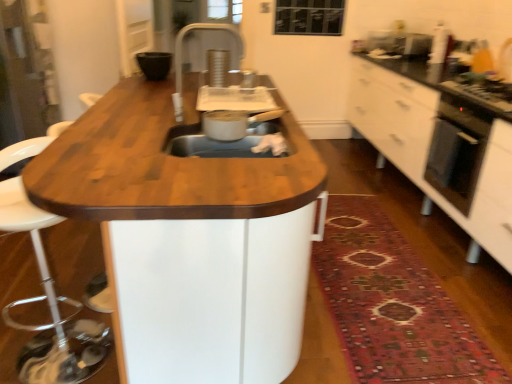
Question: From the image's perspective, is wooden table at center below white glossy cabinet at right?

Choices:
 (A) no
 (B) yes

Answer: (B)

Question: Does wooden table at center have a greater height compared to white glossy cabinet at right?

Choices:
 (A) yes
 (B) no

Answer: (A)

Question: Is wooden table at center positioned behind white glossy cabinet at right?

Choices:
 (A) yes
 (B) no

Answer: (B)

Question: Is there a large distance between wooden table at center and white glossy cabinet at right?

Choices:
 (A) no
 (B) yes

Answer: (B)

Question: Is wooden table at center oriented towards white glossy cabinet at right?

Choices:
 (A) no
 (B) yes

Answer: (A)

Question: In terms of height, does metallic silver pot at center sink look taller or shorter compared to wooden swivel chair at left?

Choices:
 (A) short
 (B) tall

Answer: (A)

Question: Which is correct: metallic silver pot at center sink is inside wooden swivel chair at left, or outside of it?

Choices:
 (A) outside
 (B) inside

Answer: (A)

Question: From the image's perspective, is metallic silver pot at center sink positioned above or below wooden swivel chair at left?

Choices:
 (A) below
 (B) above

Answer: (B)

Question: In the image, is metallic silver pot at center sink on the left side or the right side of wooden swivel chair at left?

Choices:
 (A) right
 (B) left

Answer: (A)

Question: From the image's perspective, relative to wooden table at center, is wooden swivel chair at left above or below?

Choices:
 (A) below
 (B) above

Answer: (A)

Question: From their relative heights in the image, would you say wooden swivel chair at left is taller or shorter than wooden table at center?

Choices:
 (A) tall
 (B) short

Answer: (B)

Question: Considering the relative positions of wooden swivel chair at left and wooden table at center in the image provided, is wooden swivel chair at left to the left or to the right of wooden table at center?

Choices:
 (A) left
 (B) right

Answer: (A)

Question: From a real-world perspective, is wooden swivel chair at left above or below wooden table at center?

Choices:
 (A) above
 (B) below

Answer: (B)

Question: In terms of size, does white glossy cabinet at right appear bigger or smaller than black matte bowl at upper center?

Choices:
 (A) small
 (B) big

Answer: (B)

Question: In the image, is white glossy cabinet at right on the left side or the right side of black matte bowl at upper center?

Choices:
 (A) right
 (B) left

Answer: (A)